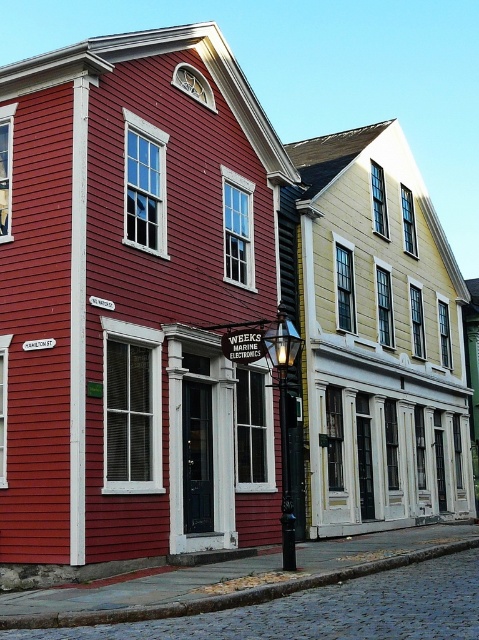
Does white wood trim at upper center have a greater width compared to white wood trim at center?

Incorrect, white wood trim at upper center's width does not surpass white wood trim at center's.

Is point (275, 202) farther from camera compared to point (305, 458)?

Yes.

Is point (275, 156) less distant than point (387, 401)?

Yes.

The height and width of the screenshot is (640, 479). In order to click on white wood trim at upper center in this screenshot , I will do `click(134, 305)`.